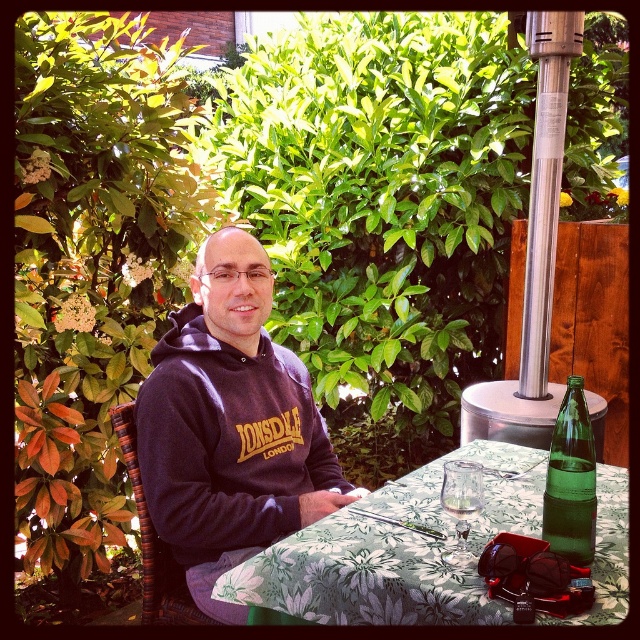
Does green glass bottle at right lie in front of clear glass wine glass at table center?

That is True.

Is point (588, 524) positioned after point (467, 461)?

No, (588, 524) is in front of (467, 461).

Who is more distant from viewer, (560, 541) or (461, 481)?

Positioned behind is point (560, 541).

Find the location of a particular element. This screenshot has width=640, height=640. green glass bottle at right is located at coordinates (570, 481).

Can you confirm if floral fabric table at center is positioned below clear glass wine glass at table center?

Indeed, floral fabric table at center is positioned under clear glass wine glass at table center.

This screenshot has width=640, height=640. What do you see at coordinates (396, 552) in the screenshot?
I see `floral fabric table at center` at bounding box center [396, 552].

Where is `floral fabric table at center`? Image resolution: width=640 pixels, height=640 pixels. floral fabric table at center is located at coordinates (396, 552).

How much distance is there between floral fabric table at center and green glass bottle at right?

floral fabric table at center is 10.36 inches away from green glass bottle at right.

Which is more to the right, floral fabric table at center or green glass bottle at right?

From the viewer's perspective, green glass bottle at right appears more on the right side.

Image resolution: width=640 pixels, height=640 pixels. Identify the location of floral fabric table at center. (396, 552).

Image resolution: width=640 pixels, height=640 pixels. In order to click on floral fabric table at center in this screenshot , I will do [x=396, y=552].